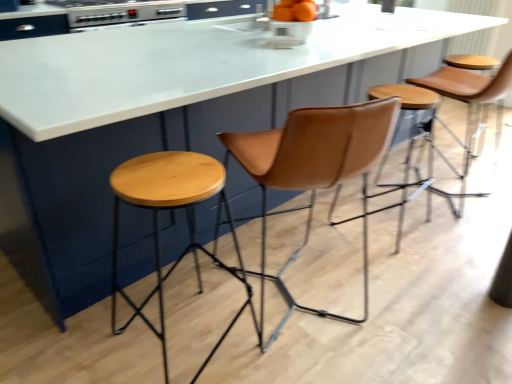
Where is `free space behind leather stool at center, the second stool positioned from the left`? This screenshot has height=384, width=512. free space behind leather stool at center, the second stool positioned from the left is located at coordinates (362, 187).